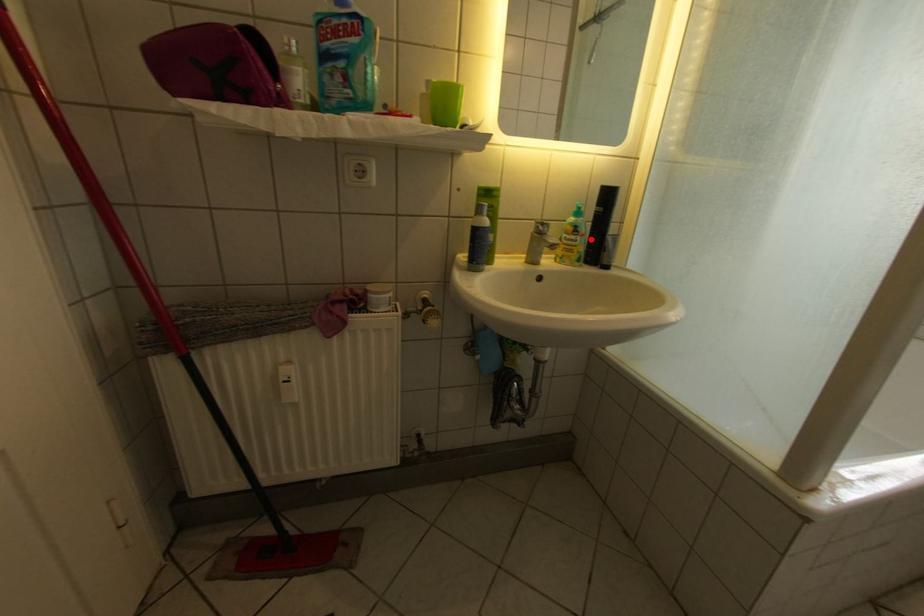
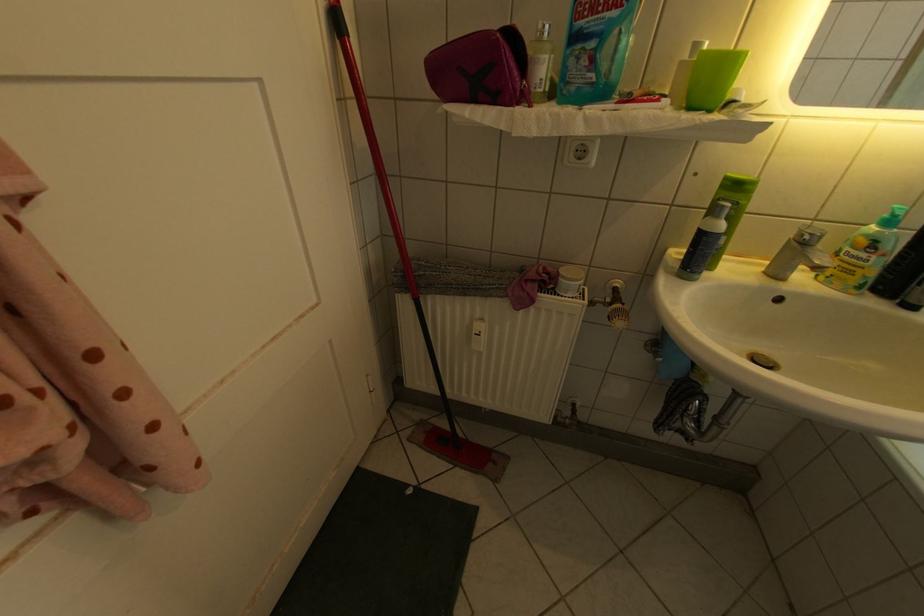
Find the pixel in the second image that matches the highlighted location in the first image.

(888, 257)